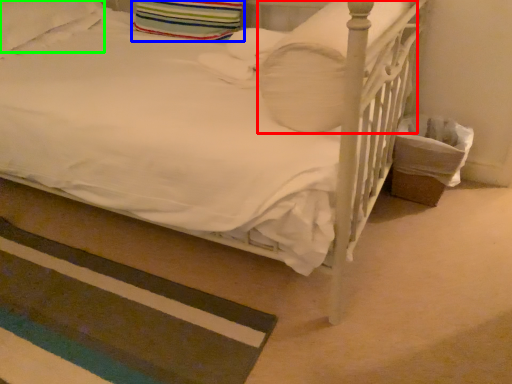
Question: Which object is the farthest from pillow (highlighted by a red box)? Choose among these: pillow (highlighted by a blue box) or pillow (highlighted by a green box).

Choices:
 (A) pillow
 (B) pillow

Answer: (B)